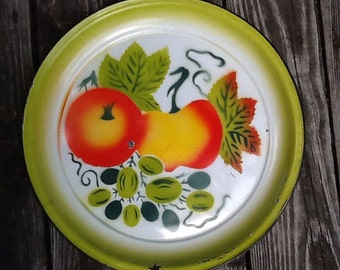
Image resolution: width=340 pixels, height=270 pixels. I want to click on wood board background, so click(316, 225).